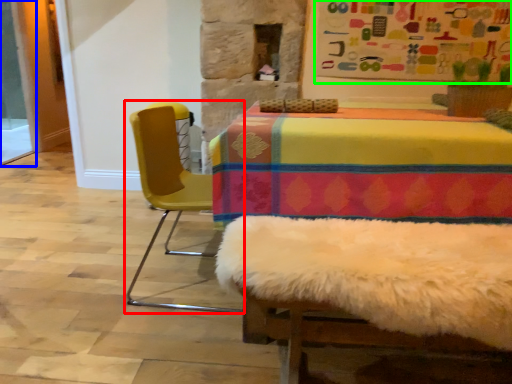
Question: Which object is the closest to the chair (highlighted by a red box)? Choose among these: screen door (highlighted by a blue box) or bulletin board (highlighted by a green box).

Choices:
 (A) screen door
 (B) bulletin board

Answer: (B)